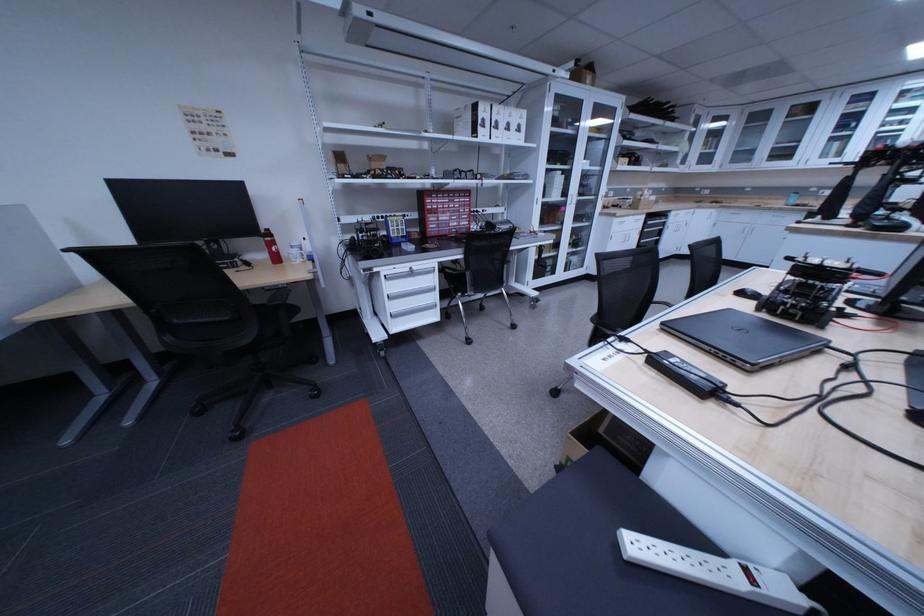
This screenshot has height=616, width=924. I want to click on black chair armrest, so click(x=281, y=301).